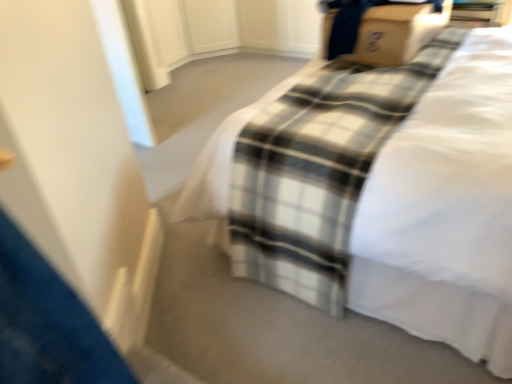
The width and height of the screenshot is (512, 384). What do you see at coordinates (396, 33) in the screenshot? I see `cardboard box at upper right` at bounding box center [396, 33].

Find the location of `cardboard box at upper right`. cardboard box at upper right is located at coordinates (396, 33).

Measure the distance between cardboard box at upper right and camera.

cardboard box at upper right is 1.74 meters away from camera.

This screenshot has height=384, width=512. Find the location of `white cotton bed at center`. white cotton bed at center is located at coordinates (445, 211).

What do you see at coordinates (445, 211) in the screenshot?
I see `white cotton bed at center` at bounding box center [445, 211].

Identify the location of cardboard box at upper right. Image resolution: width=512 pixels, height=384 pixels. (396, 33).

Can you confirm if white cotton bed at center is positioned to the right of cardboard box at upper right?

In fact, white cotton bed at center is to the left of cardboard box at upper right.

Considering the relative positions of white cotton bed at center and cardboard box at upper right in the image provided, is white cotton bed at center in front of cardboard box at upper right?

That is True.

Which point is more forward, [461,337] or [369,12]?

The point [461,337] is more forward.

Based on the photo, from the image's perspective, which one is positioned lower, white cotton bed at center or cardboard box at upper right?

white cotton bed at center appears lower in the image.

From a real-world perspective, is white cotton bed at center located beneath cardboard box at upper right?

Correct, in the physical world, white cotton bed at center is lower than cardboard box at upper right.

Does white cotton bed at center have a greater width compared to cardboard box at upper right?

Indeed, white cotton bed at center has a greater width compared to cardboard box at upper right.

Who is taller, white cotton bed at center or cardboard box at upper right?

With more height is white cotton bed at center.

Considering the sizes of white cotton bed at center and cardboard box at upper right in the image, is white cotton bed at center bigger or smaller than cardboard box at upper right?

In the image, white cotton bed at center appears to be larger than cardboard box at upper right.

Is white cotton bed at center situated inside cardboard box at upper right or outside?

white cotton bed at center is located beyond the bounds of cardboard box at upper right.

Is white cotton bed at center not near cardboard box at upper right?

They are positioned close to each other.

Is white cotton bed at center facing away from cardboard box at upper right?

Yes, white cotton bed at center is facing away from cardboard box at upper right.

Can you tell me how much white cotton bed at center and cardboard box at upper right differ in facing direction?

The angle between the facing direction of white cotton bed at center and the facing direction of cardboard box at upper right is 2.07 degrees.

How much distance is there between white cotton bed at center and cardboard box at upper right?

white cotton bed at center is 22.30 inches from cardboard box at upper right.

This screenshot has height=384, width=512. Find the location of `cardboard box lying on the right of white cotton bed at center`. cardboard box lying on the right of white cotton bed at center is located at coordinates (396, 33).

Which object is positioned more to the right, cardboard box at upper right or white cotton bed at center?

Positioned to the right is cardboard box at upper right.

Which object is more forward, cardboard box at upper right or white cotton bed at center?

white cotton bed at center is in front.

Considering the positions of point (368, 41) and point (504, 133), is point (368, 41) closer or farther from the camera than point (504, 133)?

Point (368, 41) is farther from the camera than point (504, 133).

From the image's perspective, is cardboard box at upper right on white cotton bed at center?

Yes, from the image's perspective, cardboard box at upper right is on top of white cotton bed at center.

From a real-world perspective, which is physically above, cardboard box at upper right or white cotton bed at center?

cardboard box at upper right.

Which of these two, cardboard box at upper right or white cotton bed at center, is thinner?

cardboard box at upper right.

Does cardboard box at upper right have a lesser height compared to white cotton bed at center?

Indeed, cardboard box at upper right has a lesser height compared to white cotton bed at center.

Does cardboard box at upper right have a smaller size compared to white cotton bed at center?

Yes, cardboard box at upper right is smaller than white cotton bed at center.

Which is correct: cardboard box at upper right is inside white cotton bed at center, or outside of it?

cardboard box at upper right fits inside white cotton bed at center.

Is cardboard box at upper right touching white cotton bed at center?

cardboard box at upper right is not next to white cotton bed at center, and they're not touching.

Is cardboard box at upper right turned away from white cotton bed at center?

Yes, cardboard box at upper right is facing away from white cotton bed at center.

Find the location of a particular element. The width and height of the screenshot is (512, 384). bed to the left of cardboard box at upper right is located at coordinates (445, 211).

This screenshot has height=384, width=512. In the image, there is a cardboard box at upper right. In order to click on bed below it (from a real-world perspective) in this screenshot , I will do `click(445, 211)`.

Find the location of a particular element. This screenshot has width=512, height=384. cardboard box on the right of the white cotton bed at center is located at coordinates (396, 33).